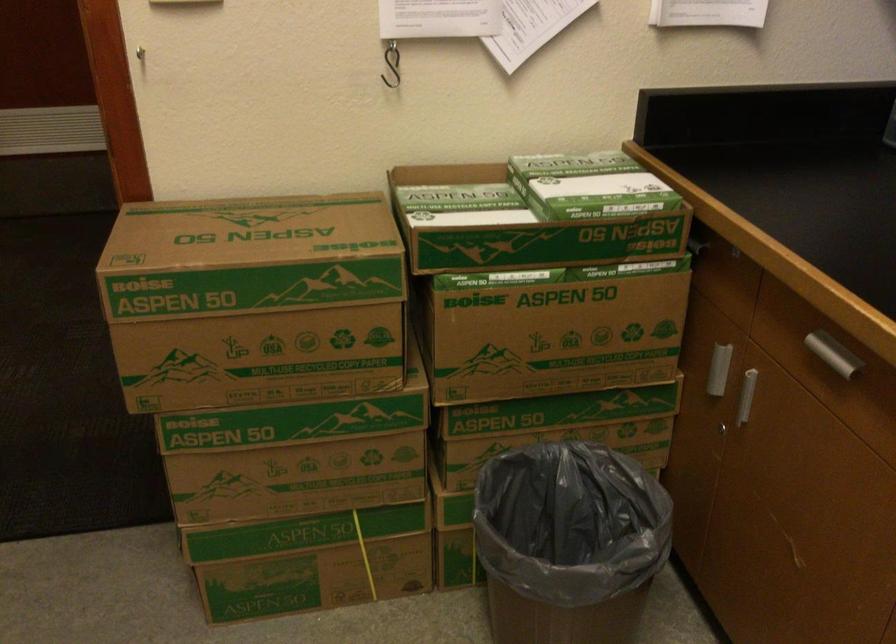
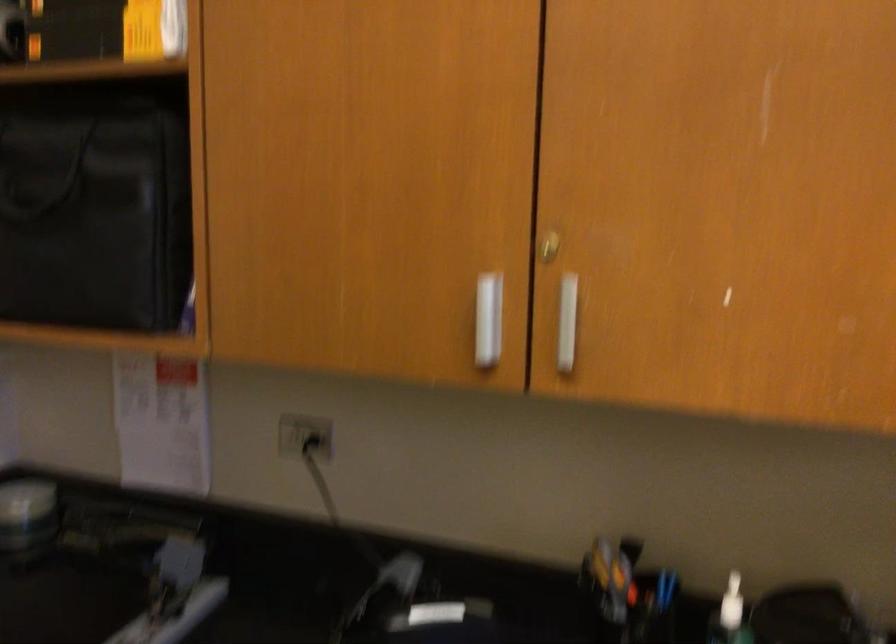
Question: The camera is either moving clockwise (left) or counter-clockwise (right) around the object. The first image is from the beginning of the video and the second image is from the end. Is the camera moving left or right when shooting the video?

Choices:
 (A) Left
 (B) Right

Answer: (A)